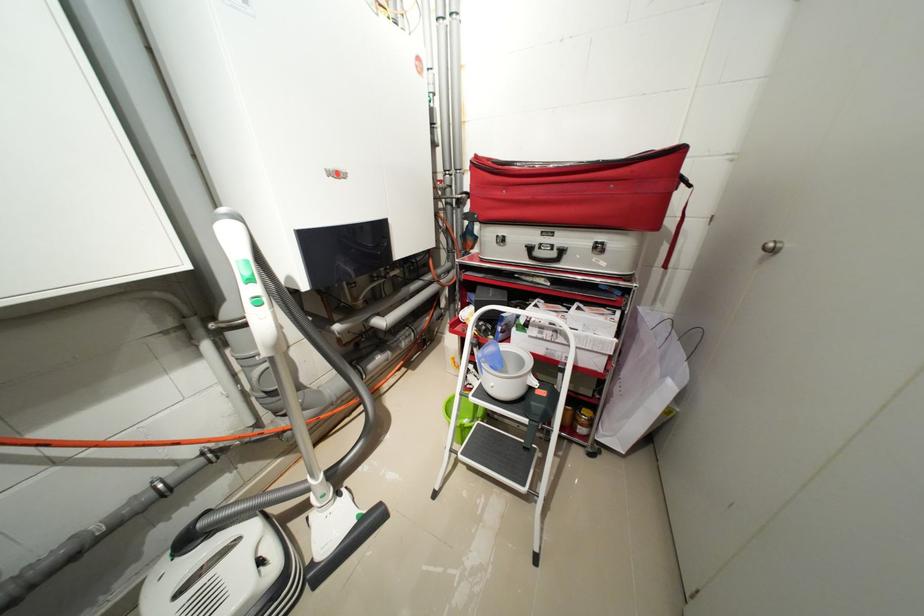
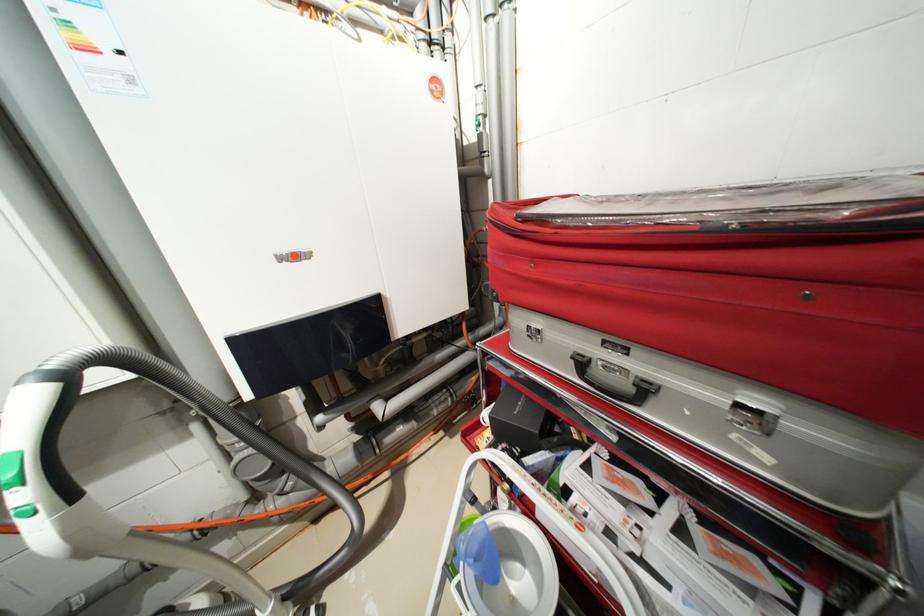
Find the pixel in the second image that matches point 505,237 in the first image.

(536, 328)